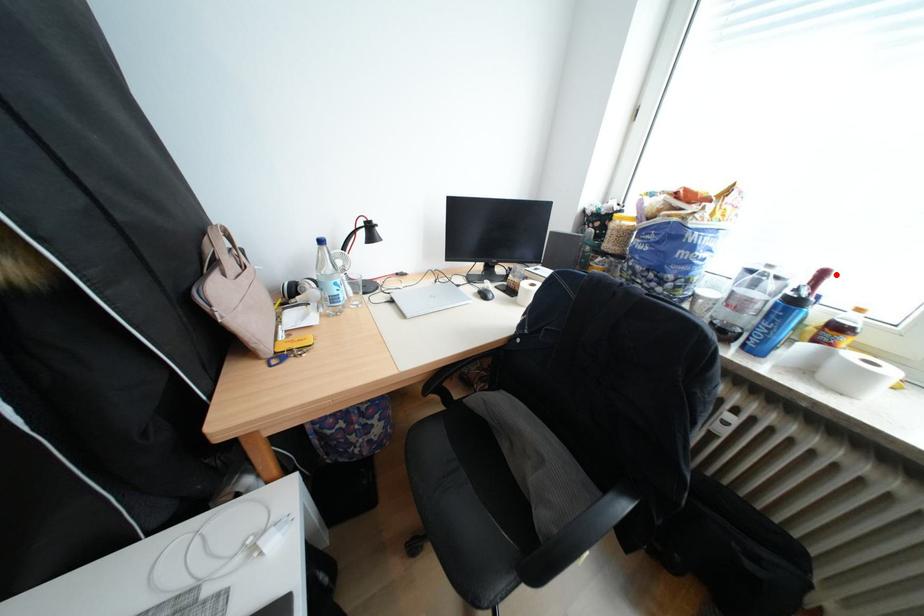
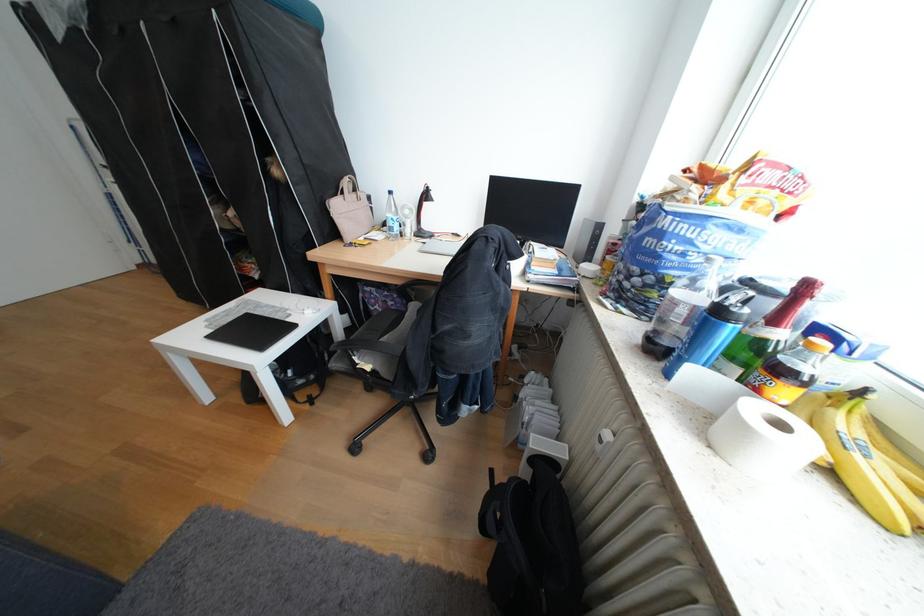
Question: I am providing you with two images of the same scene from different viewpoints. A red point is marked on the first image. Can you still see the location of the red point in image 2?

Choices:
 (A) Yes
 (B) No

Answer: (A)